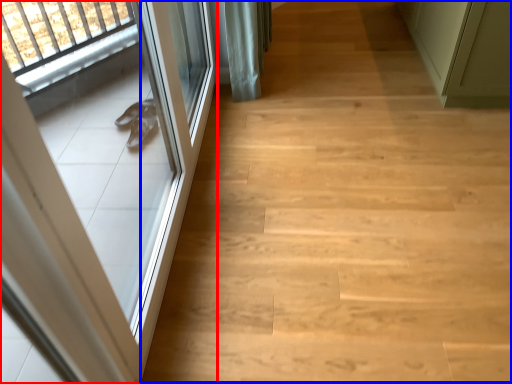
Question: Which of the following is the farthest to the observer, door (highlighted by a red box) or stairwell (highlighted by a blue box)?

Choices:
 (A) door
 (B) stairwell

Answer: (B)